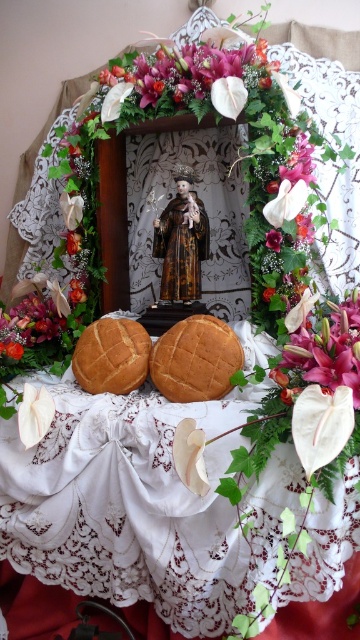
You are a guest at a religious ceremony and see the golden brown crumbly bread at center and the purple glossy flower at center on the altar. Which item is bigger?

The golden brown crumbly bread at center is larger in size than the purple glossy flower at center.

You are a guest at a religious ceremony and see the golden brown crusty bread at center and the purple glossy flower at center on the altar. Which one is taller?

The golden brown crusty bread at center is much taller than the purple glossy flower at center.